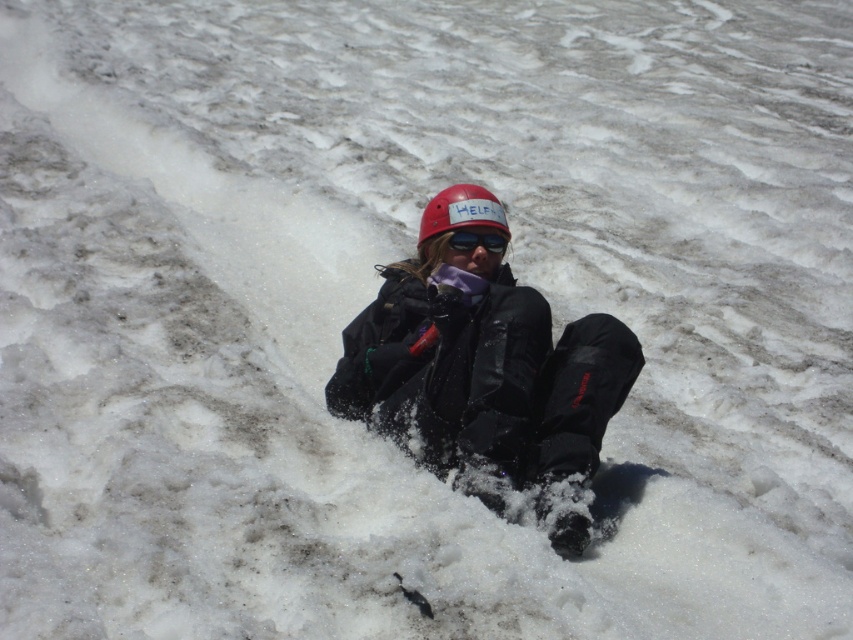
Question: Which object is the farthest from the matte black jacket at center?

Choices:
 (A) black reflective sunglasses at center
 (B) matte red helmet at center

Answer: (B)

Question: Which point is farther from the camera taking this photo?

Choices:
 (A) tap(488, 241)
 (B) tap(367, 358)
 (C) tap(508, 225)

Answer: (B)

Question: Is matte black jacket at center thinner than matte red helmet at center?

Choices:
 (A) yes
 (B) no

Answer: (B)

Question: Is matte red helmet at center positioned before black reflective sunglasses at center?

Choices:
 (A) yes
 (B) no

Answer: (B)

Question: Which object appears closest to the camera in this image?

Choices:
 (A) matte black jacket at center
 (B) matte red helmet at center
 (C) black reflective sunglasses at center

Answer: (A)

Question: Can you confirm if matte red helmet at center is positioned to the right of black reflective sunglasses at center?

Choices:
 (A) no
 (B) yes

Answer: (A)